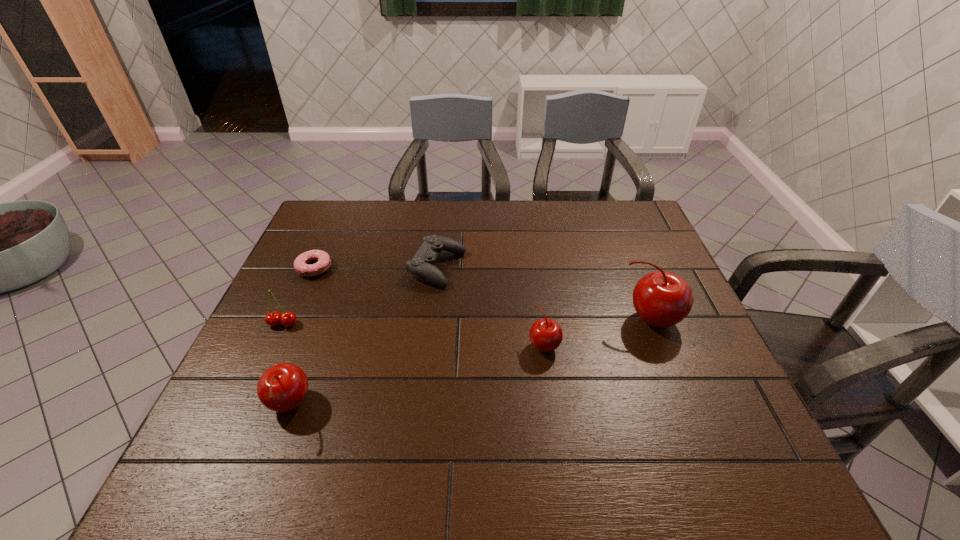
At what (x,y) coordinates should I click in order to perform the action: click on free space located 0.120m on the left of the third cherry from left to right. Please return your answer as a coordinate pair (x, y). The image size is (960, 540). Looking at the image, I should click on (479, 345).

The image size is (960, 540). I want to click on vacant space located 0.390m on the back of the rightmost object, so click(x=611, y=221).

This screenshot has height=540, width=960. What are the coordinates of `vacant region located 0.070m on the left of the control` in the screenshot? It's located at click(386, 268).

The width and height of the screenshot is (960, 540). What are the coordinates of `vacant region located on the front of the doughnut` in the screenshot? It's located at (302, 296).

Where is `vacant space situated 0.160m with the stems of the leftmost cherry pointing upwards`? Image resolution: width=960 pixels, height=540 pixels. vacant space situated 0.160m with the stems of the leftmost cherry pointing upwards is located at coordinates (256, 383).

The height and width of the screenshot is (540, 960). Identify the location of object that is at the near edge. (283, 387).

Where is `doughnut present at the left edge`? doughnut present at the left edge is located at coordinates (301, 264).

Where is `object located at the right edge`? object located at the right edge is located at coordinates (661, 299).

I want to click on object that is at the near left corner, so click(x=283, y=387).

Locate an element on the screen. free space at the far edge is located at coordinates (484, 214).